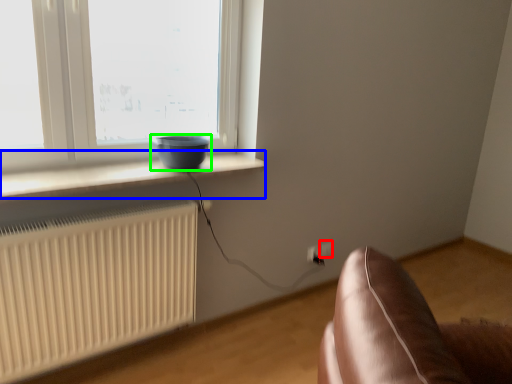
Question: Which object is the farthest from electric outlet (highlighted by a red box)? Choose among these: window sill (highlighted by a blue box) or bowl (highlighted by a green box).

Choices:
 (A) window sill
 (B) bowl

Answer: (A)